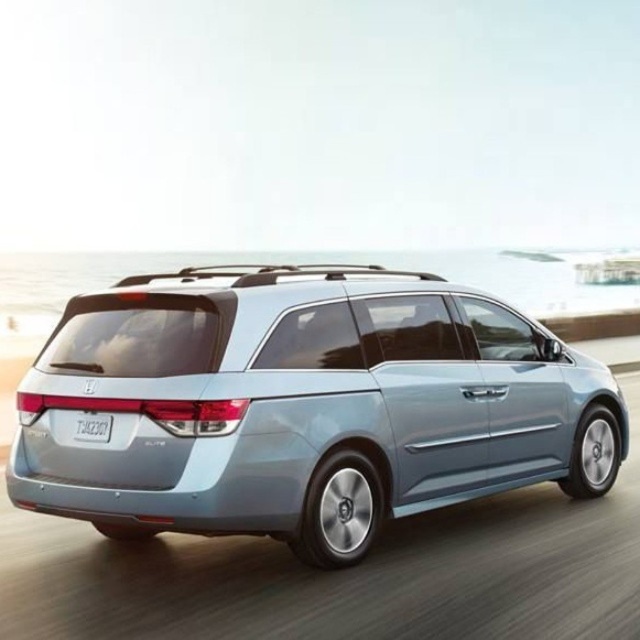
Can you confirm if satin metallic minivan at center is positioned below white plastic license plate at center?

Correct, satin metallic minivan at center is located below white plastic license plate at center.

Between point (253, 444) and point (108, 429), which one is positioned behind?

Positioned behind is point (108, 429).

Where is `satin metallic minivan at center`? Image resolution: width=640 pixels, height=640 pixels. satin metallic minivan at center is located at coordinates (304, 404).